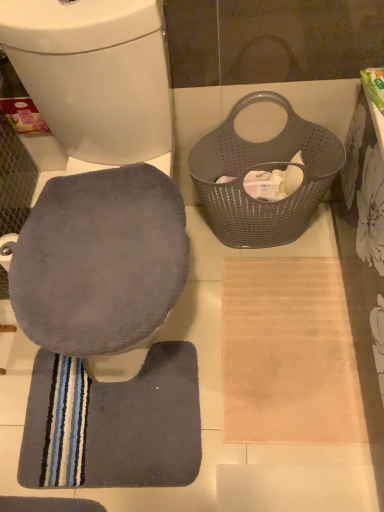
I want to click on gray fabric toilet seat at lower left, so click(x=96, y=75).

What do you see at coordinates (114, 423) in the screenshot? Image resolution: width=384 pixels, height=512 pixels. I see `dark gray plush bath mat at lower left` at bounding box center [114, 423].

I want to click on gray fabric toilet seat at lower left, so click(x=96, y=75).

Is dark gray plush bath mat at lower left at the right side of gray perforated laundry basket at upper right?

No, dark gray plush bath mat at lower left is not to the right of gray perforated laundry basket at upper right.

From a real-world perspective, is dark gray plush bath mat at lower left under gray perforated laundry basket at upper right?

Indeed, from a real-world perspective, dark gray plush bath mat at lower left is positioned beneath gray perforated laundry basket at upper right.

Looking at the image, does dark gray plush bath mat at lower left seem bigger or smaller compared to gray perforated laundry basket at upper right?

In the image, dark gray plush bath mat at lower left appears to be smaller than gray perforated laundry basket at upper right.

Is dark gray plush bath mat at lower left turned away from gray perforated laundry basket at upper right?

No.

Which is closer, (247, 213) or (154, 133)?

Clearly, point (247, 213) is more distant from the camera than point (154, 133).

Is gray perforated laundry basket at upper right facing towards gray fabric toilet seat at lower left?

No, gray perforated laundry basket at upper right does not turn towards gray fabric toilet seat at lower left.

Is gray perforated laundry basket at upper right in contact with gray fabric toilet seat at lower left?

No, gray perforated laundry basket at upper right is not with gray fabric toilet seat at lower left.

Is the position of gray perforated laundry basket at upper right more distant than that of gray fabric toilet seat at lower left?

Yes, it is behind gray fabric toilet seat at lower left.

Is gray fabric toilet seat at lower left further to the viewer compared to dark gray plush bath mat at lower left?

No, gray fabric toilet seat at lower left is closer to the camera.

Would you say gray fabric toilet seat at lower left contains dark gray plush bath mat at lower left?

No.

Is gray fabric toilet seat at lower left far away from dark gray plush bath mat at lower left?

gray fabric toilet seat at lower left is near dark gray plush bath mat at lower left, not far away.

In terms of width, does gray fabric toilet seat at lower left look wider or thinner when compared to dark gray plush bath mat at lower left?

Considering their sizes, gray fabric toilet seat at lower left looks broader than dark gray plush bath mat at lower left.

Is dark gray plush bath mat at lower left positioned beyond the bounds of gray fabric toilet seat at lower left?

dark gray plush bath mat at lower left is positioned outside gray fabric toilet seat at lower left.

Is dark gray plush bath mat at lower left oriented away from gray fabric toilet seat at lower left?

Yes, gray fabric toilet seat at lower left is at the back of dark gray plush bath mat at lower left.

Consider the image. Is dark gray plush bath mat at lower left far from gray fabric toilet seat at lower left?

No, dark gray plush bath mat at lower left is in close proximity to gray fabric toilet seat at lower left.

From a real-world perspective, relative to gray fabric toilet seat at lower left, is dark gray plush bath mat at lower left vertically above or below?

Clearly, from a real-world perspective, dark gray plush bath mat at lower left is below gray fabric toilet seat at lower left.

Can you tell me how much gray fabric toilet seat at lower left and gray perforated laundry basket at upper right differ in facing direction?

The angular difference between gray fabric toilet seat at lower left and gray perforated laundry basket at upper right is 2.2 degrees.

Is gray fabric toilet seat at lower left positioned with its back to gray perforated laundry basket at upper right?

gray fabric toilet seat at lower left is not turned away from gray perforated laundry basket at upper right.

Is gray fabric toilet seat at lower left taller than gray perforated laundry basket at upper right?

Yes.

Which point is more distant from viewer, (245, 226) or (99, 396)?

Point (245, 226)

From the picture: Is gray perforated laundry basket at upper right not close to dark gray plush bath mat at lower left?

They are positioned close to each other.

What's the angular difference between gray perforated laundry basket at upper right and dark gray plush bath mat at lower left's facing directions?

They differ by 14.8 degrees in their facing directions.

From a real-world perspective, between gray perforated laundry basket at upper right and dark gray plush bath mat at lower left, who is vertically lower?

dark gray plush bath mat at lower left, from a real-world perspective.

Where is `laundry basket in front of the dark gray plush bath mat at lower left`? laundry basket in front of the dark gray plush bath mat at lower left is located at coordinates (266, 170).

At what (x,y) coordinates should I click in order to perform the action: click on toilet above the gray perforated laundry basket at upper right (from a real-world perspective). Please return your answer as a coordinate pair (x, y). The height and width of the screenshot is (512, 384). Looking at the image, I should click on (96, 75).

Looking at the image, which one is located closer to gray perforated laundry basket at upper right, dark gray plush bath mat at lower left or gray fabric toilet seat at lower left?

gray fabric toilet seat at lower left is positioned closer to the anchor gray perforated laundry basket at upper right.

When comparing their distances from dark gray plush bath mat at lower left, does gray perforated laundry basket at upper right or gray fabric toilet seat at lower left seem closer?

gray perforated laundry basket at upper right lies closer to dark gray plush bath mat at lower left than the other object.

Looking at the image, which one is located further to gray perforated laundry basket at upper right, gray fabric toilet seat at lower left or dark gray plush bath mat at lower left?

dark gray plush bath mat at lower left lies further to gray perforated laundry basket at upper right than the other object.

Considering their positions, is dark gray plush bath mat at lower left positioned further to gray fabric toilet seat at lower left than gray perforated laundry basket at upper right?

Based on the image, dark gray plush bath mat at lower left appears to be further to gray fabric toilet seat at lower left.

Based on their spatial positions, is gray perforated laundry basket at upper right or dark gray plush bath mat at lower left further from gray fabric toilet seat at lower left?

The object further to gray fabric toilet seat at lower left is dark gray plush bath mat at lower left.

Considering their positions, is gray fabric toilet seat at lower left positioned closer to dark gray plush bath mat at lower left than gray perforated laundry basket at upper right?

Based on the image, gray perforated laundry basket at upper right appears to be nearer to dark gray plush bath mat at lower left.

Where is `toilet that lies between gray perforated laundry basket at upper right and dark gray plush bath mat at lower left from top to bottom`? This screenshot has width=384, height=512. toilet that lies between gray perforated laundry basket at upper right and dark gray plush bath mat at lower left from top to bottom is located at coordinates (96, 75).